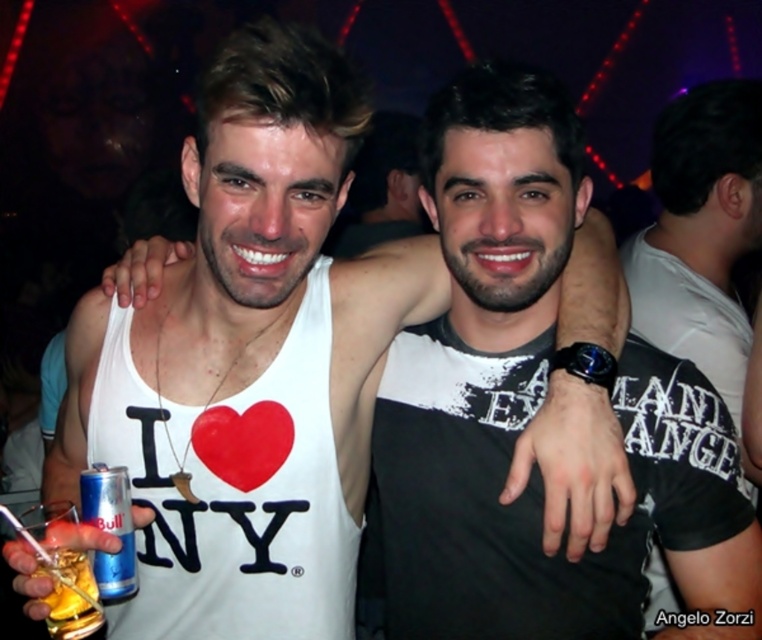
You are a photographer trying to capture a candid shot of the two people in the image. You notice two specific points marked in the scene. Which point, point 1 at coordinates point (728, 314) or point 2 at coordinates point (119, 550), is positioned further back from the camera lens? Please answer based on their spatial relationship in the image.

Point 1 at coordinates point (728, 314) is positioned further back from the camera lens compared to point 2 at coordinates point (119, 550), as stated in the objects description.

You are at a party and want to grab a drink from the table where the blue metallic can at lower left and the translucent glass at lower left are placed. Which one is on top?

The blue metallic can at lower left is positioned over the translucent glass at lower left, so it is on top.